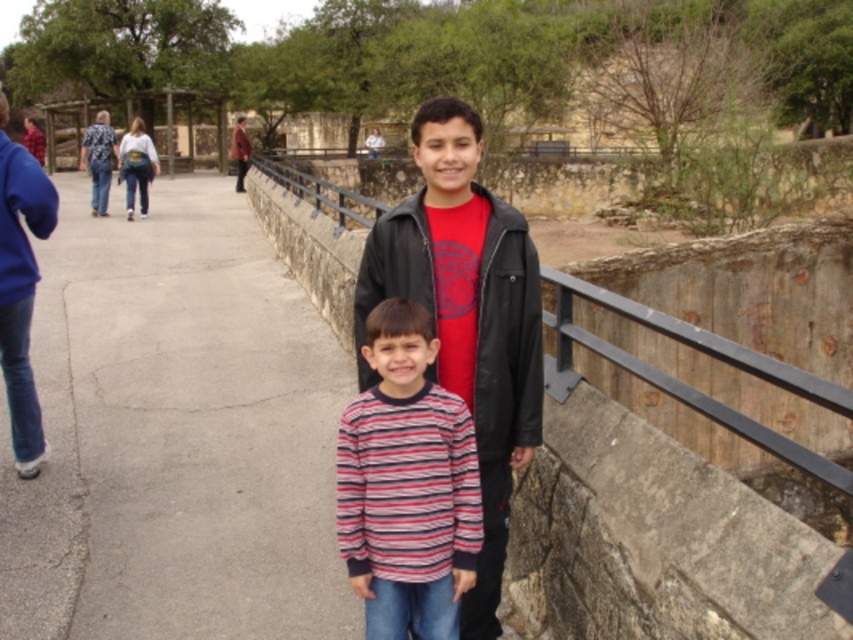
Consider the image. Between blue floral shirt at upper left and red plaid shirt at center, which one has more height?

With more height is blue floral shirt at upper left.

Identify the location of blue floral shirt at upper left. pos(97,160).

Is point (103, 163) positioned after point (33, 138)?

No, (103, 163) is closer to viewer.

You are a GUI agent. You are given a task and a screenshot of the screen. Output one action in this format:
    pyautogui.click(x=<x>, y=<y>)
    Task: Click on the blue floral shirt at upper left
    The image size is (853, 640).
    Given the screenshot: What is the action you would take?
    pyautogui.click(x=97, y=160)

Is black leather jacket at center bigger than blue fleece jacket at left?

No.

Who is higher up, black leather jacket at center or blue fleece jacket at left?

blue fleece jacket at left is higher up.

Measure the distance between point (403, 200) and camera.

Point (403, 200) and camera are 31.06 meters apart.

Find the location of a particular element. black leather jacket at center is located at coordinates (508, 337).

Is brown leather jacket at center to the left of red plaid shirt at center from the viewer's perspective?

Incorrect, brown leather jacket at center is not on the left side of red plaid shirt at center.

The width and height of the screenshot is (853, 640). Identify the location of brown leather jacket at center. (239, 150).